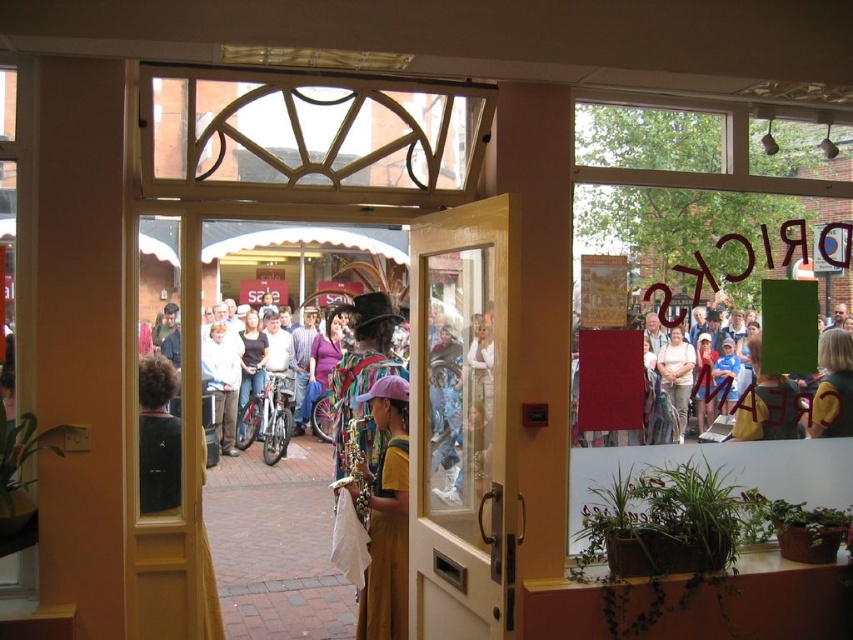
Can you confirm if yellow fabric shirt at center is positioned to the right of denim jacket at center?

Yes, yellow fabric shirt at center is to the right of denim jacket at center.

Is yellow fabric shirt at center thinner than denim jacket at center?

Correct, yellow fabric shirt at center's width is less than denim jacket at center's.

At what (x,y) coordinates should I click in order to perform the action: click on yellow fabric shirt at center. Please return your answer as a coordinate pair (x, y). The image size is (853, 640). Looking at the image, I should click on (833, 387).

Which is more to the left, golden yellow dress at center or matte white bicycle at center?

From the viewer's perspective, matte white bicycle at center appears more on the left side.

Does point (404, 524) come behind point (283, 396)?

No, (404, 524) is closer to viewer.

Who is more distant from viewer, [364,604] or [283,344]?

The point [283,344] is behind.

Where is `golden yellow dress at center`? This screenshot has height=640, width=853. golden yellow dress at center is located at coordinates (384, 515).

Who is taller, denim jeans at center or matte white bicycle at center?

Standing taller between the two is denim jeans at center.

What do you see at coordinates (251, 364) in the screenshot? This screenshot has width=853, height=640. I see `denim jeans at center` at bounding box center [251, 364].

Is point (252, 355) positioned before point (283, 356)?

Yes, it is.

You are a GUI agent. You are given a task and a screenshot of the screen. Output one action in this format:
    pyautogui.click(x=<x>, y=<y>)
    Task: Click on the denim jeans at center
    
    Given the screenshot: What is the action you would take?
    pyautogui.click(x=251, y=364)